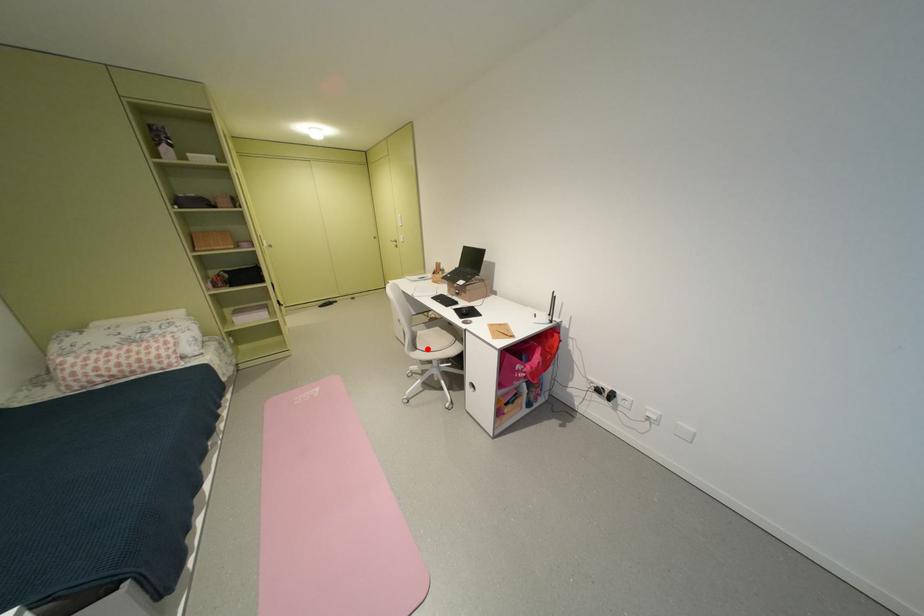
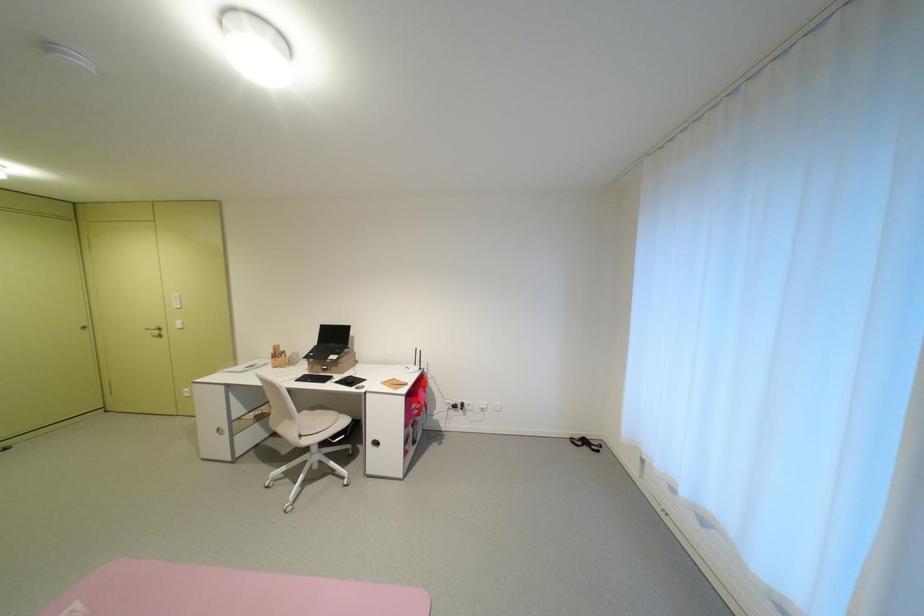
I am providing you with two images of the same scene from different viewpoints. A red point is marked on the first image and another point is marked on the second image. Do the highlighted points in image1 and image2 indicate the same real-world spot?

No